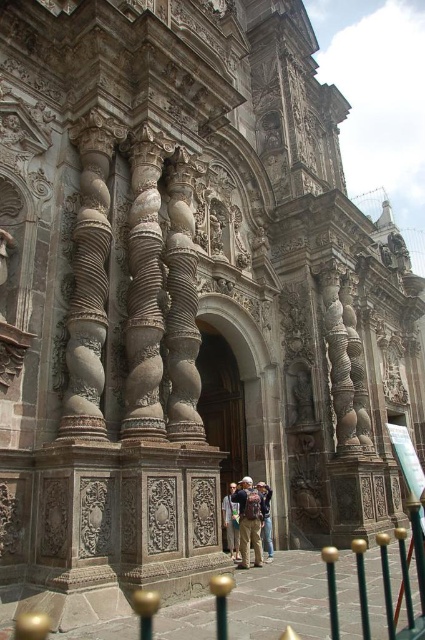
Question: Which object is the farthest from the light brown leather jacket at center?

Choices:
 (A) light brown leather backpack at center
 (B) khaki cotton pants at center

Answer: (B)

Question: Is light brown leather backpack at center wider than light brown leather jacket at center?

Choices:
 (A) no
 (B) yes

Answer: (B)

Question: Which point is farther to the camera?

Choices:
 (A) (229, 536)
 (B) (243, 490)

Answer: (A)

Question: Which point is closer to the camera?

Choices:
 (A) (268, 547)
 (B) (234, 544)

Answer: (B)

Question: Is light brown leather backpack at center to the left of light brown leather jacket at center from the viewer's perspective?

Choices:
 (A) yes
 (B) no

Answer: (A)

Question: Does khaki cotton pants at center have a lesser width compared to light brown leather jacket at center?

Choices:
 (A) no
 (B) yes

Answer: (A)